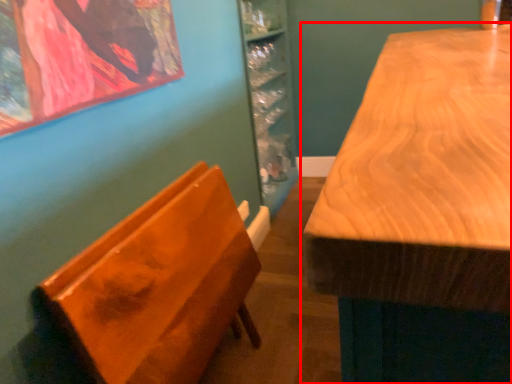
Question: From the image's perspective, what is the correct spatial positioning of table (annotated by the red box) in reference to furniture?

Choices:
 (A) below
 (B) above

Answer: (B)